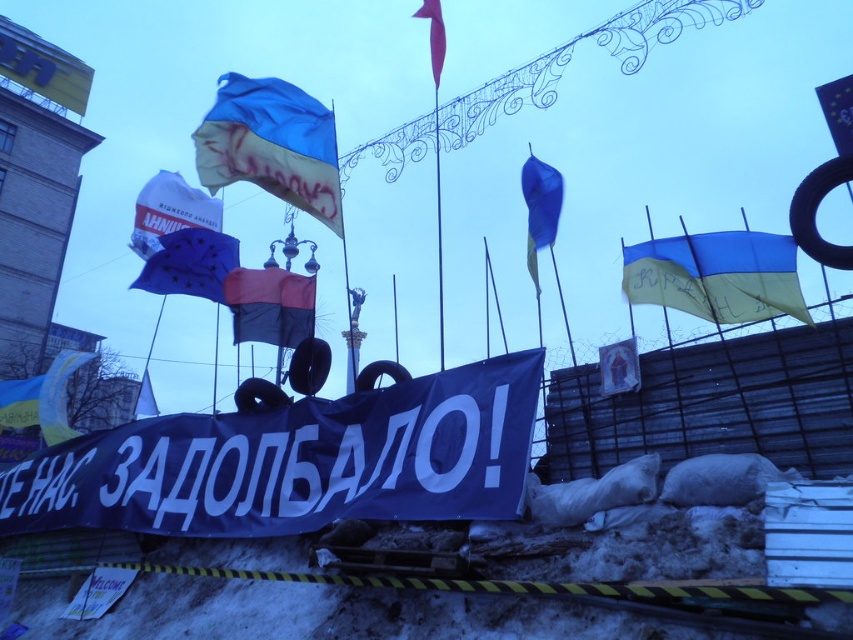
Question: Considering the relative positions of blue/yellow fabric flag at upper right and white fabric shirt at upper left in the image provided, where is blue/yellow fabric flag at upper right located with respect to white fabric shirt at upper left?

Choices:
 (A) below
 (B) above

Answer: (A)

Question: Can you confirm if white fabric shirt at upper left is bigger than matte red flag at upper center?

Choices:
 (A) no
 (B) yes

Answer: (B)

Question: Which point is farther to the camera?

Choices:
 (A) (717, 234)
 (B) (157, 413)

Answer: (B)

Question: Can you confirm if blue fabric flag at upper center is thinner than white fabric flag at center?

Choices:
 (A) no
 (B) yes

Answer: (A)

Question: Which point is farther to the camera?

Choices:
 (A) white fabric flag at center
 (B) blue fabric flag at center

Answer: (A)

Question: Considering the real-world distances, which object is farthest from the blue/yellow fabric flag at upper right?

Choices:
 (A) white fabric flag at center
 (B) black matte flag at center

Answer: (A)